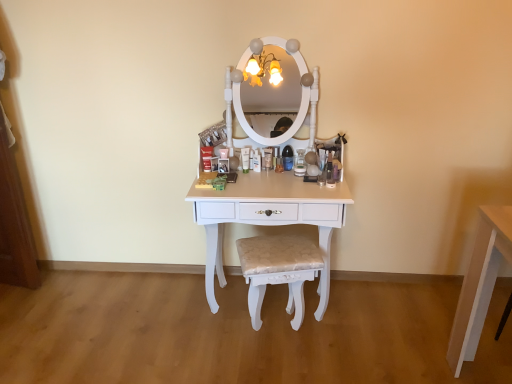
At what (x,y) coordinates should I click in order to perform the action: click on vacant region under beige fabric cushioned stool at center (from a real-world perspective). Please return your answer as a coordinate pair (x, y). The image size is (512, 384). Looking at the image, I should click on (274, 335).